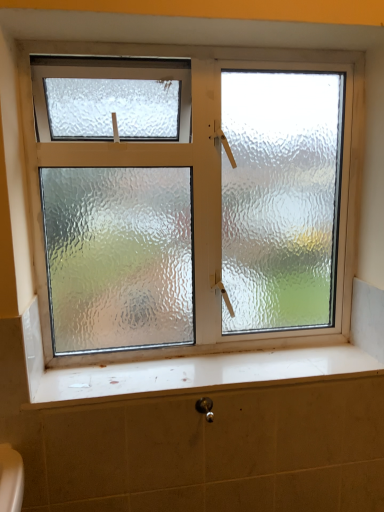
Question: Is black metallic shower at lower center at the right side of frosted glass window at center?

Choices:
 (A) no
 (B) yes

Answer: (B)

Question: From the image's perspective, is black metallic shower at lower center on frosted glass window at center?

Choices:
 (A) no
 (B) yes

Answer: (A)

Question: Can you confirm if black metallic shower at lower center is wider than frosted glass window at center?

Choices:
 (A) no
 (B) yes

Answer: (A)

Question: Could frosted glass window at center be considered to be inside black metallic shower at lower center?

Choices:
 (A) no
 (B) yes

Answer: (A)

Question: From a real-world perspective, is black metallic shower at lower center beneath frosted glass window at center?

Choices:
 (A) no
 (B) yes

Answer: (B)

Question: Is point (196, 385) closer or farther from the camera than point (218, 216)?

Choices:
 (A) closer
 (B) farther

Answer: (A)

Question: Which is correct: white glossy window sill at lower center is inside frosted glass window at center, or outside of it?

Choices:
 (A) inside
 (B) outside

Answer: (B)

Question: Is white glossy window sill at lower center wider or thinner than frosted glass window at center?

Choices:
 (A) thin
 (B) wide

Answer: (B)

Question: Is white glossy window sill at lower center to the left or to the right of frosted glass window at center in the image?

Choices:
 (A) left
 (B) right

Answer: (B)

Question: Considering the positions of point (210, 415) and point (312, 62), is point (210, 415) closer or farther from the camera than point (312, 62)?

Choices:
 (A) farther
 (B) closer

Answer: (B)

Question: In the image, is black metallic shower at lower center on the left side or the right side of frosted glass window at center?

Choices:
 (A) left
 (B) right

Answer: (B)

Question: From the image's perspective, is black metallic shower at lower center above or below frosted glass window at center?

Choices:
 (A) below
 (B) above

Answer: (A)

Question: Relative to frosted glass window at center, is black metallic shower at lower center in front or behind?

Choices:
 (A) behind
 (B) front

Answer: (B)

Question: Considering their positions, is frosted glass window at center located in front of or behind black metallic shower at lower center?

Choices:
 (A) behind
 (B) front

Answer: (A)

Question: Which is correct: frosted glass window at center is inside black metallic shower at lower center, or outside of it?

Choices:
 (A) outside
 (B) inside

Answer: (A)